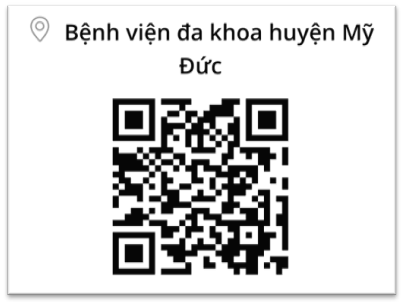
Where is `bar`? This screenshot has height=305, width=404. bar is located at coordinates (248, 235).